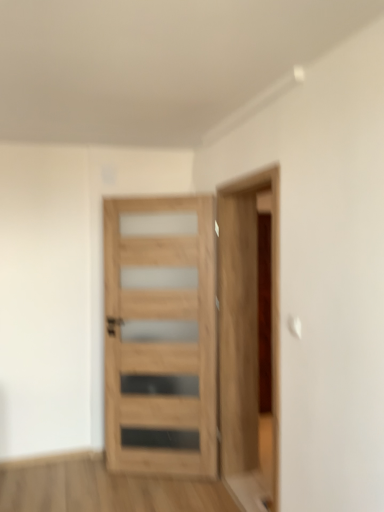
Image resolution: width=384 pixels, height=512 pixels. Describe the element at coordinates (246, 323) in the screenshot. I see `wooden door at right` at that location.

Locate an element on the screen. wooden door at right is located at coordinates (246, 323).

What is the approximate height of natural wood door at center?

The height of natural wood door at center is 6.70 feet.

This screenshot has height=512, width=384. What do you see at coordinates (161, 335) in the screenshot?
I see `natural wood door at center` at bounding box center [161, 335].

In order to face natural wood door at center, should I rotate leftwards or rightwards?

You should look left and rotate roughly 4.227 degrees.

This screenshot has height=512, width=384. In order to click on natural wood door at center in this screenshot , I will do `click(161, 335)`.

Find the location of a particular element. wooden door at right is located at coordinates (246, 323).

Which is more to the right, wooden door at right or natural wood door at center?

wooden door at right.

Is the position of wooden door at right less distant than that of natural wood door at center?

Yes, wooden door at right is in front of natural wood door at center.

Is point (237, 414) closer to viewer compared to point (203, 213)?

No, (237, 414) is further to viewer.

From the image's perspective, is wooden door at right positioned above or below natural wood door at center?

Clearly, from the image's perspective, wooden door at right is above natural wood door at center.

From a real-world perspective, is wooden door at right over natural wood door at center?

Yes, from a real-world perspective, wooden door at right is on top of natural wood door at center.

Which object is wider, wooden door at right or natural wood door at center?

With larger width is wooden door at right.

Is wooden door at right shorter than natural wood door at center?

No.

Is wooden door at right smaller than natural wood door at center?

Actually, wooden door at right might be larger than natural wood door at center.

Is natural wood door at center completely or partially inside wooden door at right?

No, wooden door at right does not contain natural wood door at center.

Is the surface of wooden door at right in direct contact with natural wood door at center?

They are not placed beside each other.

Is wooden door at right oriented away from natural wood door at center?

That's not correct — wooden door at right is not looking away from natural wood door at center.

How different are the orientations of wooden door at right and natural wood door at center in degrees?

The facing directions of wooden door at right and natural wood door at center are 66.6 degrees apart.

Find the location of a particular element. The height and width of the screenshot is (512, 384). door below the wooden door at right (from a real-world perspective) is located at coordinates (161, 335).

Which object is positioned more to the right, natural wood door at center or wooden door at right?

From the viewer's perspective, wooden door at right appears more on the right side.

Is natural wood door at center positioned before wooden door at right?

No, natural wood door at center is further to the viewer.

Is point (141, 334) behind point (270, 191)?

Yes, point (141, 334) is behind point (270, 191).

Consider the image. From the image's perspective, would you say natural wood door at center is shown under wooden door at right?

Indeed, from the image's perspective, natural wood door at center is shown beneath wooden door at right.

From a real-world perspective, is natural wood door at center below wooden door at right?

Yes, from a real-world perspective, natural wood door at center is beneath wooden door at right.

Which object is thinner, natural wood door at center or wooden door at right?

natural wood door at center.

In terms of height, does natural wood door at center look taller or shorter compared to wooden door at right?

Clearly, natural wood door at center is shorter compared to wooden door at right.

Between natural wood door at center and wooden door at right, which one has larger size?

wooden door at right.

Is wooden door at right surrounded by natural wood door at center?

Actually, wooden door at right is outside natural wood door at center.

Based on the photo, are natural wood door at center and wooden door at right far apart?

No.

Is natural wood door at center facing towards wooden door at right?

No, natural wood door at center is not facing towards wooden door at right.

How far apart are natural wood door at center and wooden door at right?

18.87 inches.

Where is `door located underneath the wooden door at right (from a real-world perspective)`? This screenshot has height=512, width=384. door located underneath the wooden door at right (from a real-world perspective) is located at coordinates (161, 335).

I want to click on garage door above the natural wood door at center (from the image's perspective), so click(x=246, y=323).

Image resolution: width=384 pixels, height=512 pixels. Find the location of `door below the wooden door at right (from a real-world perspective)`. door below the wooden door at right (from a real-world perspective) is located at coordinates (161, 335).